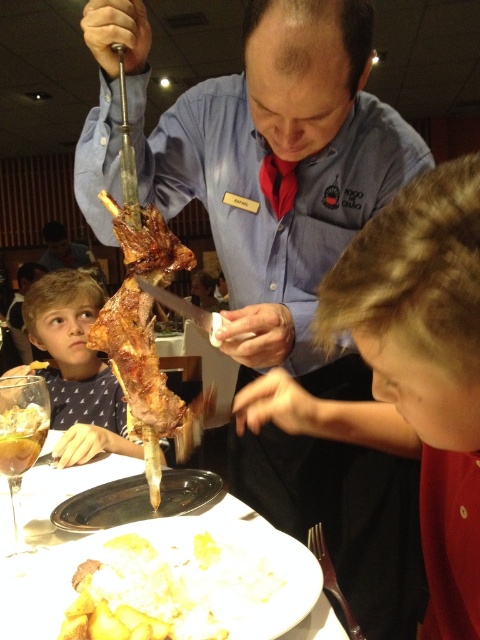
You are a server in the restaurant and need to place a 24 inch long serving tray between the white creamy mashed potatoes at lower center and the polka dot shirt at lower left. Will the tray fit without overlapping either object?

The distance between the white creamy mashed potatoes at lower center and the polka dot shirt at lower left is 24.45 inches. Since the serving tray is 24 inches long, it will fit with a small gap of 0.45 inches remaining.

You are a customer sitting at the table in the restaurant scene. You notice two points in the image. The first point is at coordinates point (407, 250) and the second is at point (2, 458). If you were to draw a straight line from your eyes to each point, which point would you reach first?

Point (407, 250) is closer to the viewer than point (2, 458), so you would reach point (407, 250) first.